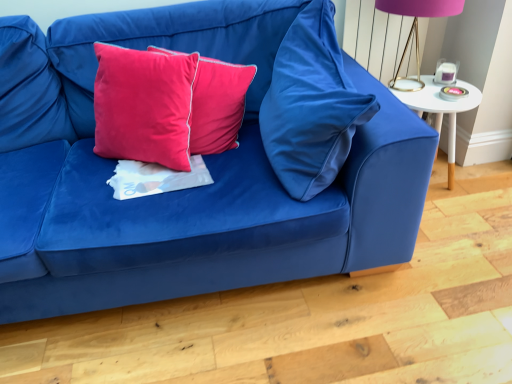
The width and height of the screenshot is (512, 384). In order to click on white glossy side table at right in this screenshot , I will do `click(441, 111)`.

This screenshot has width=512, height=384. What do you see at coordinates (441, 111) in the screenshot? I see `white glossy side table at right` at bounding box center [441, 111].

What do you see at coordinates (143, 105) in the screenshot? I see `velvet/cotton cushion at center, which is counted as the third pillow, starting from the right` at bounding box center [143, 105].

What do you see at coordinates (311, 105) in the screenshot? The width and height of the screenshot is (512, 384). I see `velvet blue pillow at center, acting as the 1th pillow starting from the right` at bounding box center [311, 105].

Locate an element on the screen. white matte sheet at center is located at coordinates (155, 178).

This screenshot has width=512, height=384. What do you see at coordinates (200, 187) in the screenshot?
I see `velvet blue couch at center` at bounding box center [200, 187].

The width and height of the screenshot is (512, 384). In order to click on purple fabric lampshade at upper right in this screenshot , I will do `click(416, 31)`.

Measure the distance from velvet/cotton cushion at center, which is counted as the third pillow, starting from the right, to white matte sheet at center.

The distance of velvet/cotton cushion at center, which is counted as the third pillow, starting from the right, from white matte sheet at center is 6.82 inches.

Where is `the 1st pillow in front of the white matte sheet at center, starting your count from the anchor`? the 1st pillow in front of the white matte sheet at center, starting your count from the anchor is located at coordinates (143, 105).

How different are the orientations of velvet/cotton cushion at center, which appears as the 1th pillow when viewed from the left, and white matte sheet at center in degrees?

55 degrees.

Consider the image. Is white matte sheet at center at the back of velvet/cotton cushion at center, which is counted as the third pillow, starting from the right?

No, white matte sheet at center is not at the back of velvet/cotton cushion at center, which is counted as the third pillow, starting from the right.

Which object is wider, velvet blue couch at center or white glossy side table at right?

With larger width is velvet blue couch at center.

Identify the location of studio couch positioned vertically above the white glossy side table at right (from a real-world perspective). The width and height of the screenshot is (512, 384). (200, 187).

From a real-world perspective, relative to white glossy side table at right, is velvet blue couch at center vertically above or below?

Clearly, from a real-world perspective, velvet blue couch at center is above white glossy side table at right.

From the image's perspective, between velvet blue couch at center and purple fabric lampshade at upper right, who is located below?

velvet blue couch at center, from the image's perspective.

Looking at this image, how different are the orientations of velvet blue couch at center and purple fabric lampshade at upper right in degrees?

There is a 5.57-degree angle between the facing directions of velvet blue couch at center and purple fabric lampshade at upper right.

From the picture: Is velvet blue couch at center not near purple fabric lampshade at upper right?

Yes, velvet blue couch at center and purple fabric lampshade at upper right are located far from each other.

Which is behind, point (110, 258) or point (434, 14)?

The point (434, 14) is farther.

Looking at this image, is velvet/cotton cushion at center, which is counted as the third pillow, starting from the right, facing towards purple fabric lampshade at upper right?

No, velvet/cotton cushion at center, which is counted as the third pillow, starting from the right, does not turn towards purple fabric lampshade at upper right.

From the image's perspective, is velvet/cotton cushion at center, which is counted as the third pillow, starting from the right, under purple fabric lampshade at upper right?

Yes, from the image's perspective, velvet/cotton cushion at center, which is counted as the third pillow, starting from the right, is beneath purple fabric lampshade at upper right.

In the scene shown: Can you confirm if velvet/cotton cushion at center, which appears as the 1th pillow when viewed from the left, is smaller than purple fabric lampshade at upper right?

Correct, velvet/cotton cushion at center, which appears as the 1th pillow when viewed from the left, occupies less space than purple fabric lampshade at upper right.

Can you tell me how much velvet/cotton cushion at center, which appears as the 1th pillow when viewed from the left, and purple fabric lampshade at upper right differ in facing direction?

22.1 degrees.

How distant is purple fabric lampshade at upper right from velvet blue pillow at center, placed as the 3th pillow when sorted from left to right?

They are 31.15 inches apart.

Considering the positions of point (383, 6) and point (307, 124), is point (383, 6) closer or farther from the camera than point (307, 124)?

Point (383, 6) is positioned farther from the camera compared to point (307, 124).

Considering the relative sizes of purple fabric lampshade at upper right and velvet blue pillow at center, placed as the 3th pillow when sorted from left to right, in the image provided, is purple fabric lampshade at upper right shorter than velvet blue pillow at center, placed as the 3th pillow when sorted from left to right,?

Yes.

Does purple fabric lampshade at upper right have a smaller size compared to velvet blue pillow at center, placed as the 3th pillow when sorted from left to right?

Yes, purple fabric lampshade at upper right is smaller than velvet blue pillow at center, placed as the 3th pillow when sorted from left to right.

Does velvet blue pillow at center, acting as the 1th pillow starting from the right, have a greater height compared to velvet/cotton cushion at center, which appears as the 1th pillow when viewed from the left?

Correct, velvet blue pillow at center, acting as the 1th pillow starting from the right, is much taller as velvet/cotton cushion at center, which appears as the 1th pillow when viewed from the left.

Is velvet blue pillow at center, acting as the 1th pillow starting from the right, positioned before velvet/cotton cushion at center, which is counted as the third pillow, starting from the right?

Yes.

Measure the distance from velvet blue pillow at center, acting as the 1th pillow starting from the right, to velvet/cotton cushion at center, which appears as the 1th pillow when viewed from the left.

velvet blue pillow at center, acting as the 1th pillow starting from the right, and velvet/cotton cushion at center, which appears as the 1th pillow when viewed from the left, are 16.69 inches apart from each other.

Where is `pillow in front of the velvet/cotton cushion at center, which appears as the 1th pillow when viewed from the left`? pillow in front of the velvet/cotton cushion at center, which appears as the 1th pillow when viewed from the left is located at coordinates (311, 105).

How many degrees apart are the facing directions of white glossy side table at right and velvet blue pillow at center, acting as the 1th pillow starting from the right?

white glossy side table at right and velvet blue pillow at center, acting as the 1th pillow starting from the right, are facing 93.4 degrees away from each other.

Is white glossy side table at right directly adjacent to velvet blue pillow at center, acting as the 1th pillow starting from the right?

white glossy side table at right is not next to velvet blue pillow at center, acting as the 1th pillow starting from the right, and they're not touching.

Measure the distance between white glossy side table at right and velvet blue pillow at center, acting as the 1th pillow starting from the right.

white glossy side table at right is 26.43 inches away from velvet blue pillow at center, acting as the 1th pillow starting from the right.

Is white glossy side table at right completely or partially outside of velvet blue pillow at center, acting as the 1th pillow starting from the right?

Indeed, white glossy side table at right is completely outside velvet blue pillow at center, acting as the 1th pillow starting from the right.

Locate an element on the screen. This screenshot has width=512, height=384. pillow to the left of white matte sheet at center is located at coordinates (143, 105).

In order to click on table on the right of velvet blue couch at center in this screenshot , I will do `click(441, 111)`.

Considering their positions, is velvet blue couch at center positioned further to white matte sheet at center than velvet blue pillow at center, acting as the 1th pillow starting from the right?

velvet blue pillow at center, acting as the 1th pillow starting from the right.

Based on their spatial positions, is velvet blue pillow at center, acting as the 1th pillow starting from the right, or velvet blue couch at center closer to white matte sheet at center?

velvet blue couch at center.

Considering their positions, is satin pink pillow at center, the second pillow when ordered from right to left, positioned further to velvet blue pillow at center, acting as the 1th pillow starting from the right, than velvet blue couch at center?

Based on the image, velvet blue couch at center appears to be further to velvet blue pillow at center, acting as the 1th pillow starting from the right.

When comparing their distances from velvet/cotton cushion at center, which is counted as the third pillow, starting from the right, does purple fabric lampshade at upper right or velvet blue couch at center seem closer?

The object closer to velvet/cotton cushion at center, which is counted as the third pillow, starting from the right, is velvet blue couch at center.

When comparing their distances from white matte sheet at center, does velvet/cotton cushion at center, which is counted as the third pillow, starting from the right, or satin pink pillow at center, which is counted as the second pillow, starting from the left, seem further?

satin pink pillow at center, which is counted as the second pillow, starting from the left.

Estimate the real-world distances between objects in this image. Which object is further from velvet blue couch at center, velvet/cotton cushion at center, which appears as the 1th pillow when viewed from the left, or purple fabric lampshade at upper right?

Based on the image, purple fabric lampshade at upper right appears to be further to velvet blue couch at center.

Based on their spatial positions, is white glossy side table at right or purple fabric lampshade at upper right further from velvet/cotton cushion at center, which appears as the 1th pillow when viewed from the left?

purple fabric lampshade at upper right is further to velvet/cotton cushion at center, which appears as the 1th pillow when viewed from the left.

Considering their positions, is velvet blue pillow at center, acting as the 1th pillow starting from the right, positioned closer to velvet blue couch at center than white matte sheet at center?

Among the two, white matte sheet at center is located nearer to velvet blue couch at center.

The image size is (512, 384). What are the coordinates of `table lamp located between velvet blue pillow at center, placed as the 3th pillow when sorted from left to right, and white glossy side table at right in the depth direction` in the screenshot? It's located at (416, 31).

I want to click on sheet between velvet/cotton cushion at center, which is counted as the third pillow, starting from the right, and velvet blue pillow at center, acting as the 1th pillow starting from the right, so click(155, 178).

I want to click on pillow situated between white matte sheet at center and velvet blue pillow at center, placed as the 3th pillow when sorted from left to right, from left to right, so click(218, 105).

Where is `pillow between satin pink pillow at center, the second pillow when ordered from right to left, and white glossy side table at right, in the horizontal direction`? The height and width of the screenshot is (384, 512). pillow between satin pink pillow at center, the second pillow when ordered from right to left, and white glossy side table at right, in the horizontal direction is located at coordinates (311, 105).